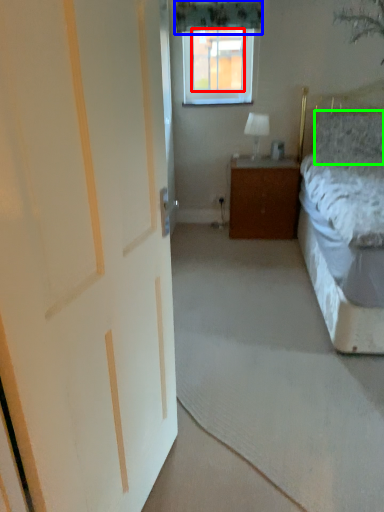
Question: Based on their relative distances, which object is nearer to window screen (highlighted by a red box)? Choose from curtain (highlighted by a blue box) and pillow (highlighted by a green box).

Choices:
 (A) curtain
 (B) pillow

Answer: (A)